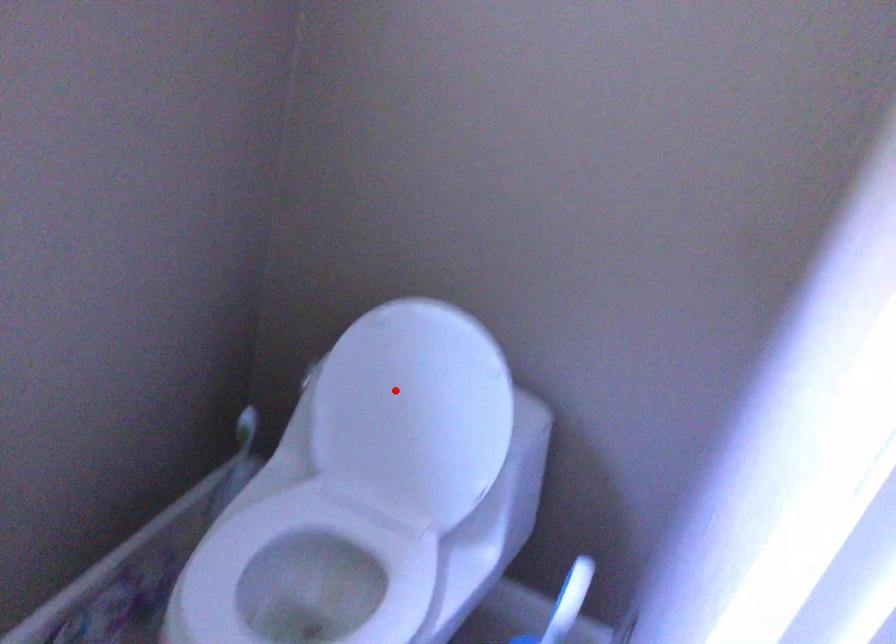
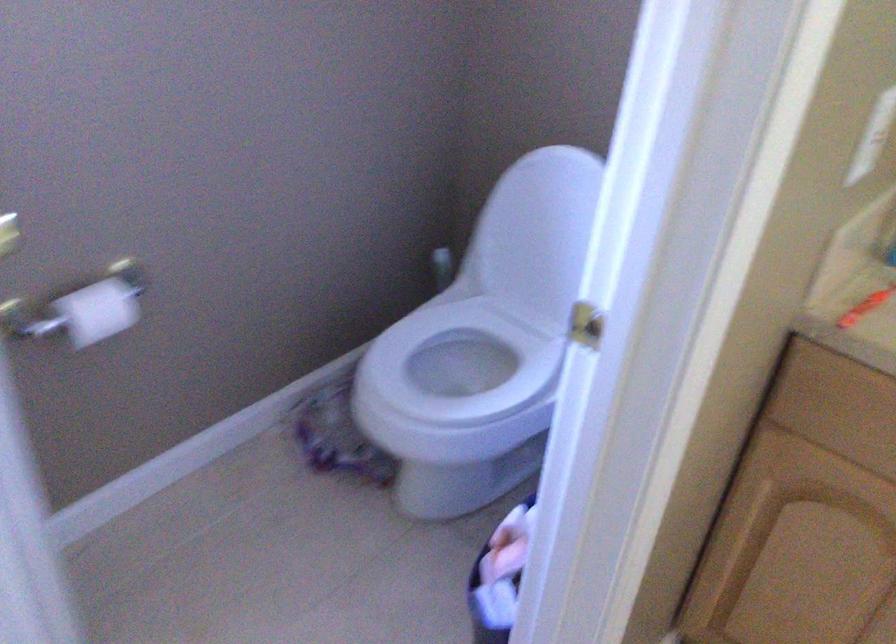
Locate, in the second image, the point that corresponds to the highlighted location in the first image.

(538, 228)